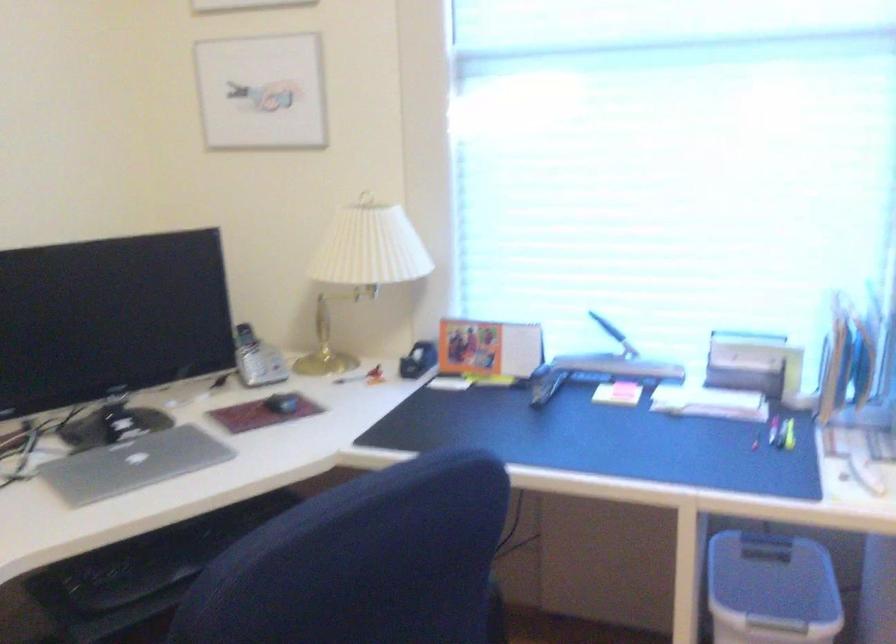
Image resolution: width=896 pixels, height=644 pixels. I want to click on closed silver laptop, so click(133, 464).